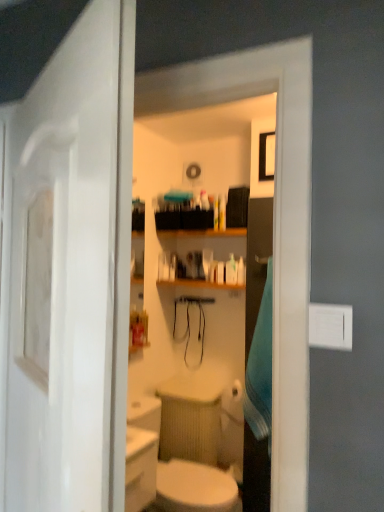
Question: Is blue fabric towel at right closer to the viewer compared to white glossy door at left?

Choices:
 (A) yes
 (B) no

Answer: (B)

Question: Is blue fabric towel at right outside white glossy door at left?

Choices:
 (A) yes
 (B) no

Answer: (A)

Question: Is white glossy door at left a part of blue fabric towel at right?

Choices:
 (A) yes
 (B) no

Answer: (B)

Question: From a real-world perspective, is blue fabric towel at right on white glossy door at left?

Choices:
 (A) no
 (B) yes

Answer: (A)

Question: Is the position of blue fabric towel at right more distant than that of white glossy door at left?

Choices:
 (A) no
 (B) yes

Answer: (B)

Question: From the image's perspective, does blue fabric towel at right appear higher than white glossy door at left?

Choices:
 (A) no
 (B) yes

Answer: (A)

Question: Is white glossy door at left touching blue fabric towel at right?

Choices:
 (A) no
 (B) yes

Answer: (A)

Question: Does white glossy door at left have a lesser height compared to blue fabric towel at right?

Choices:
 (A) yes
 (B) no

Answer: (B)

Question: Is blue fabric towel at right a part of white glossy door at left?

Choices:
 (A) no
 (B) yes

Answer: (A)

Question: Does white glossy door at left have a smaller size compared to blue fabric towel at right?

Choices:
 (A) no
 (B) yes

Answer: (A)

Question: Is white glossy door at left bigger than blue fabric towel at right?

Choices:
 (A) yes
 (B) no

Answer: (A)

Question: Can you confirm if white glossy door at left is wider than blue fabric towel at right?

Choices:
 (A) no
 (B) yes

Answer: (A)

Question: Is white glossy sink at lower center not within white glossy door at left?

Choices:
 (A) yes
 (B) no

Answer: (A)